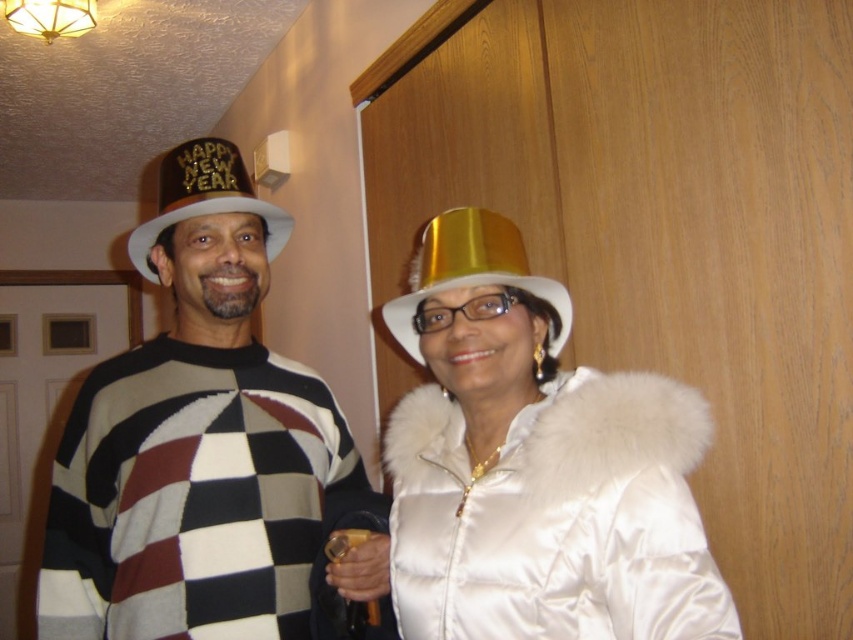
Question: Estimate the real-world distances between objects in this image. Which object is closer to the gold shiny paper hat at left?

Choices:
 (A) checkerboard sweater at left
 (B) gold shiny hat at center

Answer: (A)

Question: Is checkerboard sweater at left below gold shiny hat at center?

Choices:
 (A) no
 (B) yes

Answer: (B)

Question: Which is nearer to the checkerboard sweater at left?

Choices:
 (A) gold shiny paper hat at left
 (B) satin gold top hat at center

Answer: (A)

Question: Is checkerboard sweater at left behind gold shiny hat at center?

Choices:
 (A) yes
 (B) no

Answer: (A)

Question: Which object is farther from the camera taking this photo?

Choices:
 (A) gold shiny hat at center
 (B) gold shiny paper hat at left
 (C) checkerboard sweater at left
 (D) white satin coat at center

Answer: (B)

Question: Does gold shiny hat at center have a greater width compared to gold shiny paper hat at left?

Choices:
 (A) yes
 (B) no

Answer: (B)